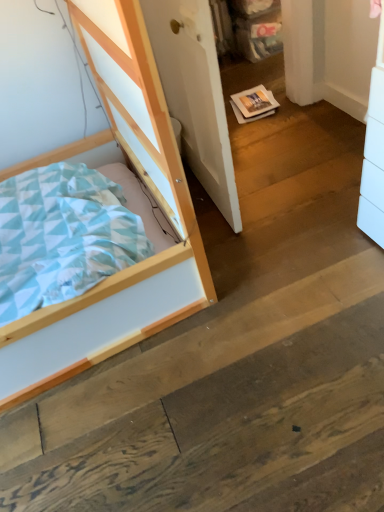
Image resolution: width=384 pixels, height=512 pixels. I want to click on free spot in front of light wood bed at left, so click(x=168, y=415).